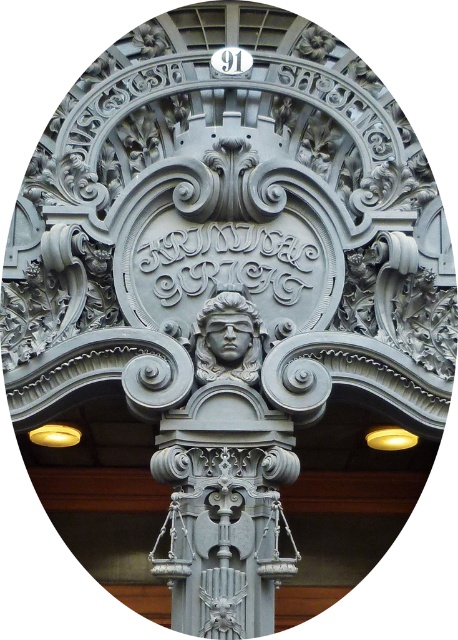
You are an architect examining the facade and want to determine which of the two points, point (250,378) or point (230,321), is closer to the viewer. Based on the architectural details provided, which point is nearer?

Point (250,378) is closer to the viewer than point (230,321).

You are an architect examining the facade and need to place a new plaque between the matte gray statue at center and the matte gray stone face at center. Based on their positions, which side should the plaque be placed on?

The matte gray statue at center is to the left of the matte gray stone face at center, so the plaque should be placed between them on the right side of the statue and the left side of the stone face.

You are an art conservator examining the architectural elements. You notice two objects, the matte gray statue at center and the matte gray stone face at center. Which one is closer to you?

The matte gray statue at center is closer to you than the matte gray stone face at center.